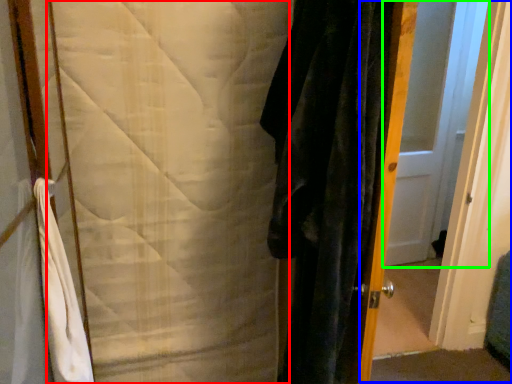
Question: Which object is the closest to the blanket (highlighted by a red box)? Choose among these: screen door (highlighted by a blue box) or door (highlighted by a green box).

Choices:
 (A) screen door
 (B) door

Answer: (A)